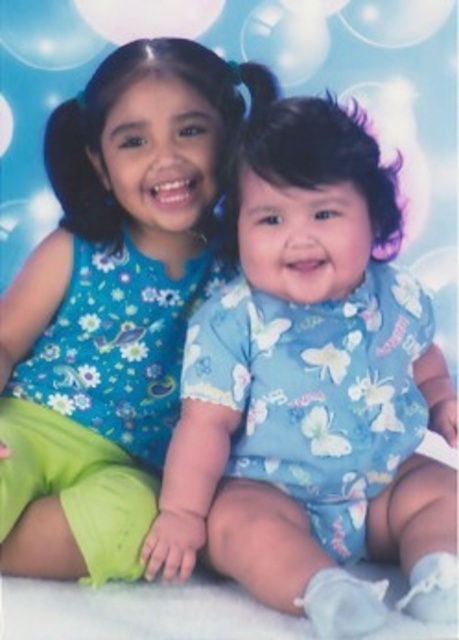
Question: Which point appears closest to the camera in this image?

Choices:
 (A) (83, 392)
 (B) (432, 528)
 (C) (201, 3)

Answer: (B)

Question: Which object is the closest to the floral fabric dress at upper left?

Choices:
 (A) transparent plastic bubble at upper center
 (B) blue fabric baby at center

Answer: (B)

Question: Does blue fabric baby at center come in front of transparent plastic bubble at upper center?

Choices:
 (A) yes
 (B) no

Answer: (A)

Question: Observing the image, what is the correct spatial positioning of blue fabric baby at center in reference to transparent plastic bubble at upper center?

Choices:
 (A) below
 (B) above

Answer: (A)

Question: Estimate the real-world distances between objects in this image. Which object is farther from the blue fabric baby at center?

Choices:
 (A) transparent plastic bubble at upper center
 (B) floral fabric dress at upper left

Answer: (A)

Question: Is blue fabric baby at center wider than floral fabric dress at upper left?

Choices:
 (A) no
 (B) yes

Answer: (B)